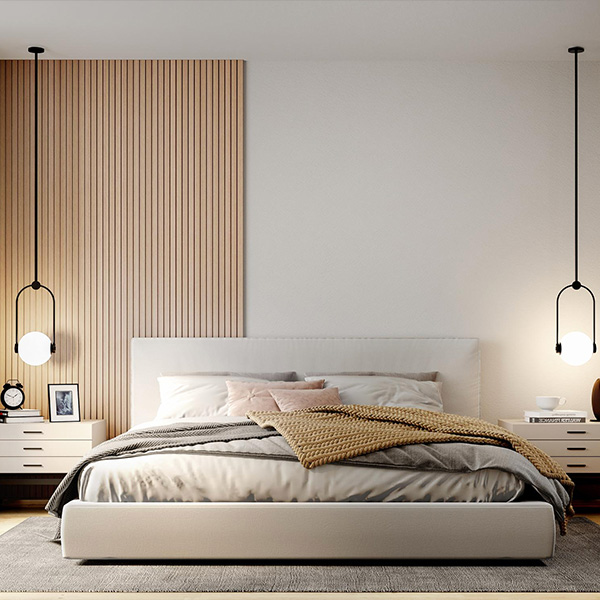
This screenshot has width=600, height=600. What are the coordinates of `rug` in the screenshot? It's located at (92, 585).